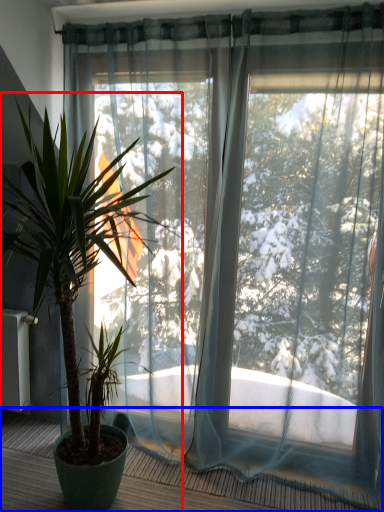
Question: Which object is closer to the camera taking this photo, houseplant (highlighted by a red box) or balcony (highlighted by a blue box)?

Choices:
 (A) houseplant
 (B) balcony

Answer: (A)